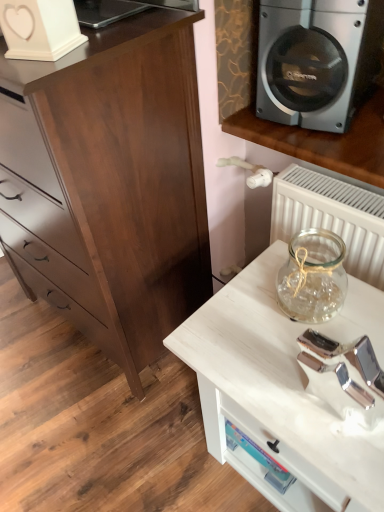
Image resolution: width=384 pixels, height=512 pixels. I want to click on free space in front of dark wood chest of drawers at left, so click(x=91, y=424).